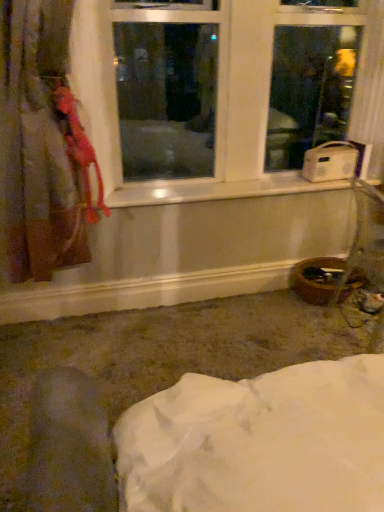
Image resolution: width=384 pixels, height=512 pixels. I want to click on blank area to the left of white plastic radio at right, so click(292, 183).